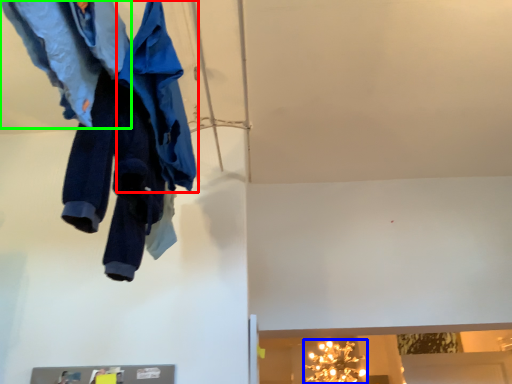
Question: Considering the real-world distances, which object is farthest from cloak (highlighted by a red box)? light fixture (highlighted by a blue box) or trousers (highlighted by a green box)?

Choices:
 (A) light fixture
 (B) trousers

Answer: (A)